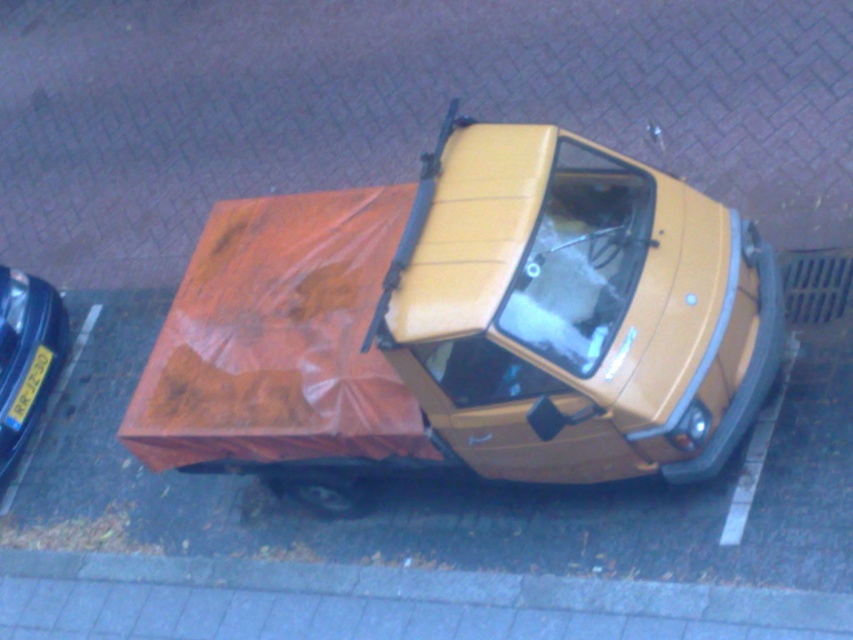
Question: Among these points, which one is nearest to the camera?

Choices:
 (A) (695, 336)
 (B) (38, 385)
 (C) (9, 420)

Answer: (A)

Question: Which point is farther to the camera?

Choices:
 (A) (10, 438)
 (B) (175, 413)
 (C) (39, 381)

Answer: (C)

Question: Among these points, which one is nearest to the camera?

Choices:
 (A) (482, 221)
 (B) (45, 369)
 (C) (59, 332)

Answer: (A)

Question: Is shiny blue car at left behind yellow plastic license plate at lower left?

Choices:
 (A) yes
 (B) no

Answer: (B)

Question: Does matte yellow car at center appear on the left side of yellow plastic license plate at lower left?

Choices:
 (A) no
 (B) yes

Answer: (A)

Question: Is matte yellow car at center closer to camera compared to yellow plastic license plate at lower left?

Choices:
 (A) yes
 (B) no

Answer: (A)